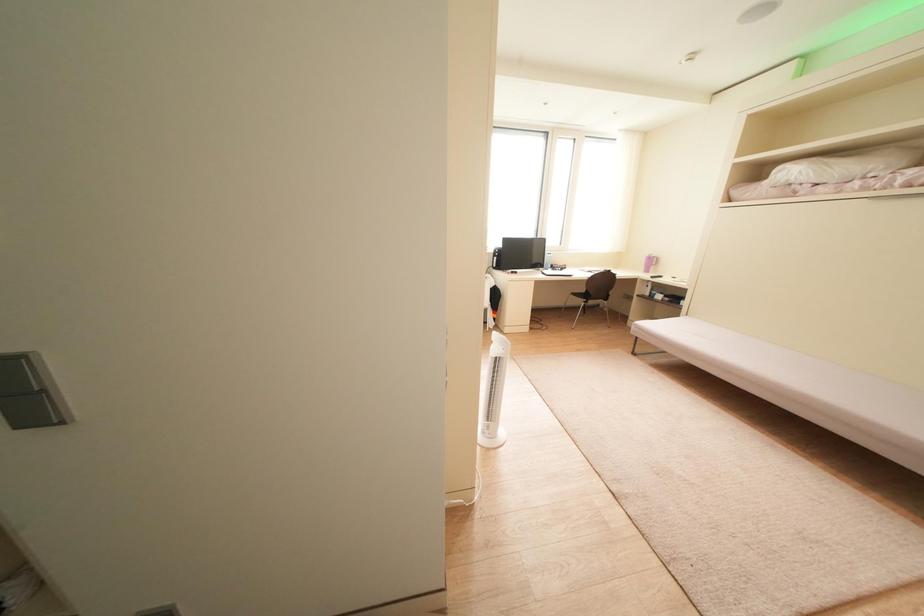
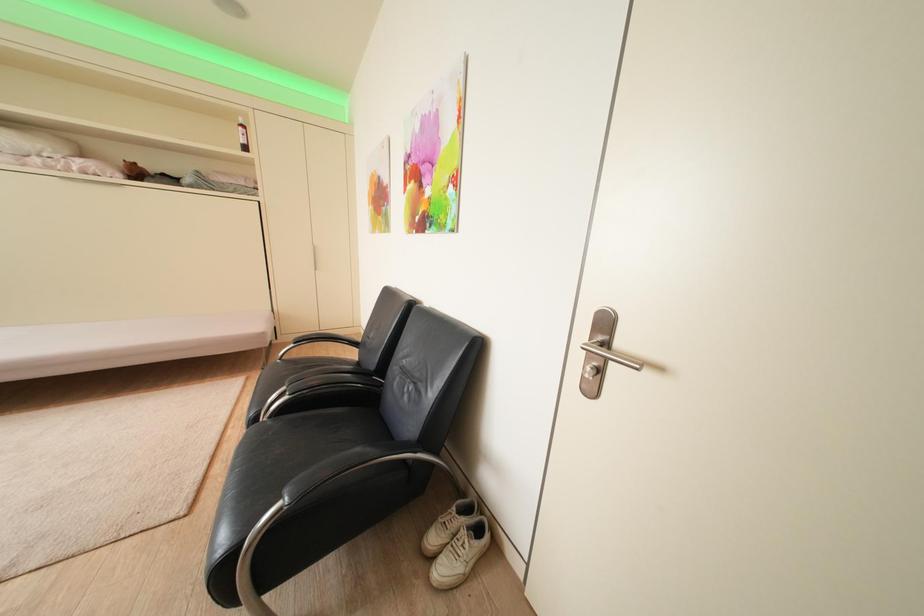
The images are taken continuously from a first-person perspective. In which direction is your viewpoint rotating?

The camera's rotation is toward right-down.